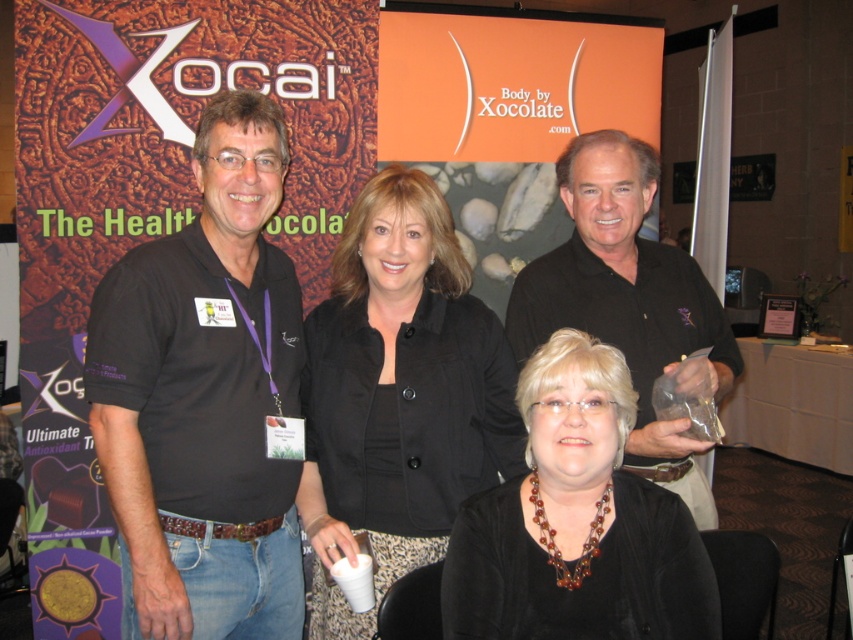
Question: Can you confirm if black shirt at left is positioned below black fabric jacket at center?

Choices:
 (A) yes
 (B) no

Answer: (B)

Question: Is black velvet blouse at center positioned at the back of black matte shirt at center?

Choices:
 (A) no
 (B) yes

Answer: (A)

Question: Which of the following is the closest to the observer?

Choices:
 (A) black matte shirt at center
 (B) black velvet blouse at center
 (C) black fabric jacket at center
 (D) black shirt at left

Answer: (B)

Question: Based on their relative distances, which object is farther from the black shirt at left?

Choices:
 (A) black velvet blouse at center
 (B) black fabric jacket at center

Answer: (A)

Question: Does black velvet blouse at center appear on the right side of black matte shirt at center?

Choices:
 (A) yes
 (B) no

Answer: (B)

Question: Which of the following is the farthest from the observer?

Choices:
 (A) (669, 368)
 (B) (474, 308)
 (C) (611, 490)
 (D) (268, 520)

Answer: (B)